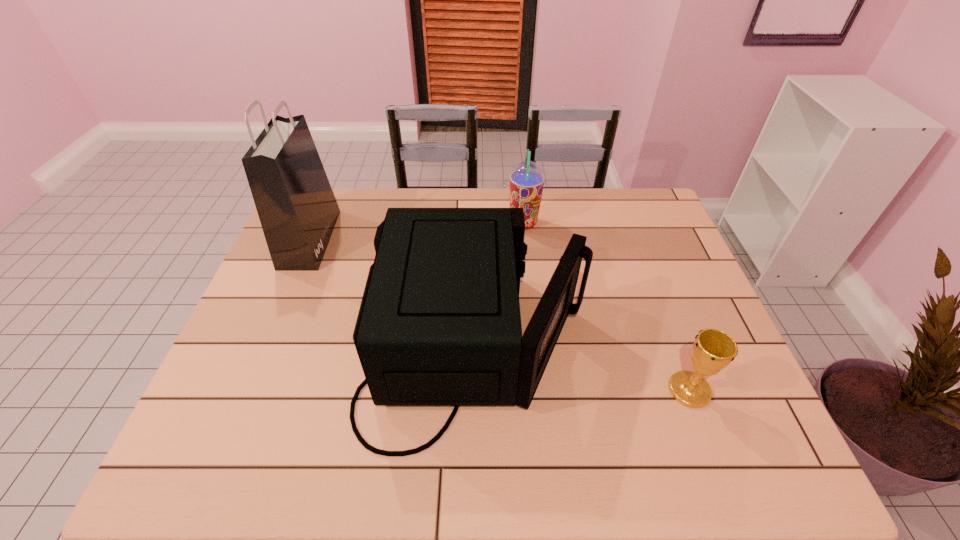
I want to click on the tallest object, so click(x=297, y=209).

Locate an element on the screen. The height and width of the screenshot is (540, 960). shopping bag is located at coordinates (297, 209).

Find the location of a particular element. smoothie is located at coordinates (527, 179).

Find the location of a particular element. microwave oven is located at coordinates (439, 324).

Find the location of a particular element. The image size is (960, 540). the shortest object is located at coordinates (713, 350).

Find the location of `the rightmost object`. the rightmost object is located at coordinates (713, 350).

Locate an element on the screen. free space located on the front with handles of the leftmost object is located at coordinates click(x=434, y=239).

This screenshot has height=540, width=960. In order to click on free space located 0.260m on the right of the smoothie in this screenshot , I will do `click(619, 223)`.

The image size is (960, 540). I want to click on free region located 0.080m with the door open on the microwave oven, so click(x=617, y=347).

The height and width of the screenshot is (540, 960). Identify the location of vacant space located on the left of the rightmost object. (504, 390).